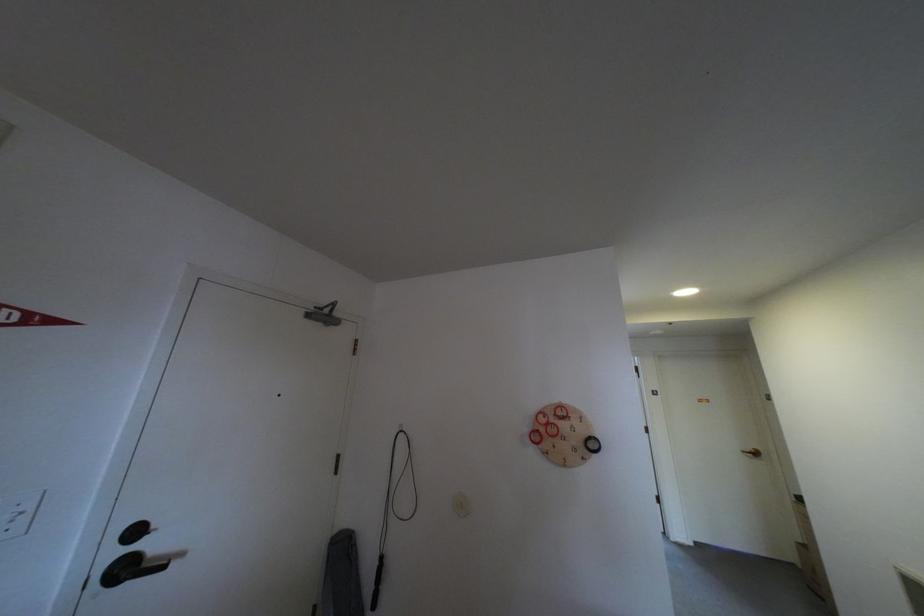
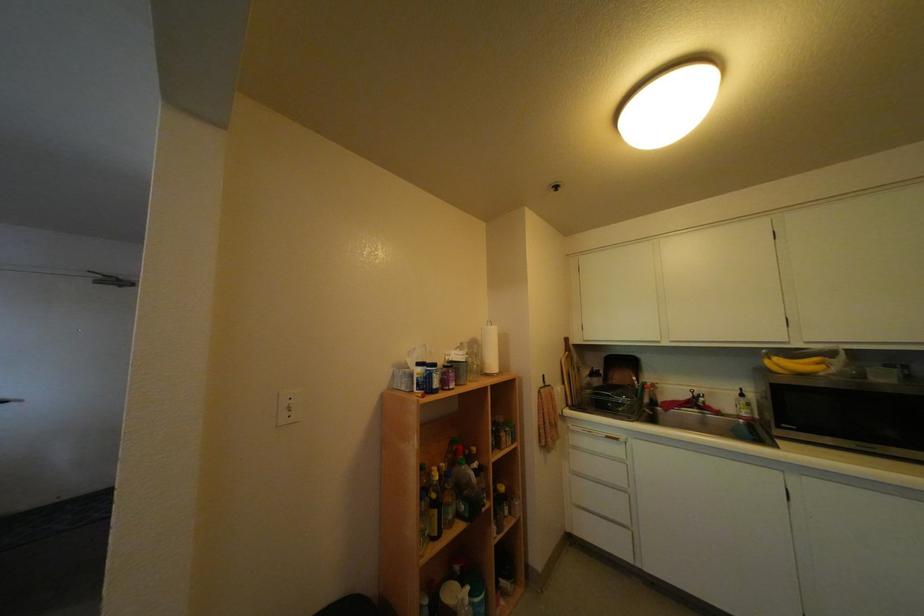
Question: Which direction would the cameraman need to move to produce the second image? Reply with the corresponding letter.

Choices:
 (A) Left
 (B) Right
 (C) Forward
 (D) Backward

Answer: (B)